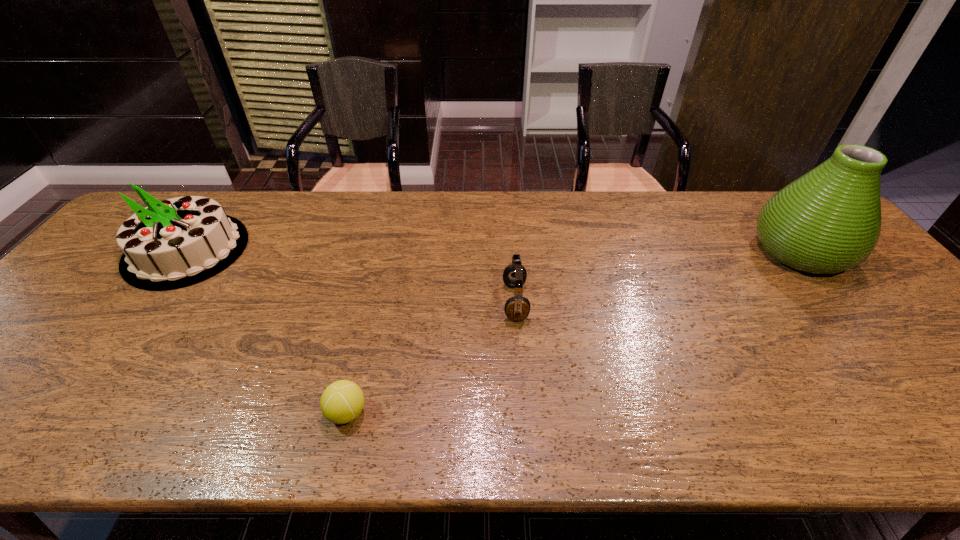
The image size is (960, 540). What are the coordinates of `object that is at the far right corner` in the screenshot? It's located at tap(827, 221).

I want to click on vacant space at the far edge of the desktop, so click(x=673, y=220).

Where is `free space at the near edge of the desktop`? The height and width of the screenshot is (540, 960). free space at the near edge of the desktop is located at coordinates (127, 424).

The image size is (960, 540). Identify the location of vacant region at the left edge of the desktop. (22, 356).

I want to click on vacant position at the right edge of the desktop, so [x=939, y=376].

Find the location of `free space between the rightmost object and the tennis ball`. free space between the rightmost object and the tennis ball is located at coordinates (573, 332).

Find the location of `free space between the tallest object and the nearest object`. free space between the tallest object and the nearest object is located at coordinates (573, 332).

Image resolution: width=960 pixels, height=540 pixels. I want to click on free area in between the shortest object and the vase, so click(573, 332).

In order to click on free space between the nearest object and the vase in this screenshot , I will do `click(573, 332)`.

Identify the location of unoccupied position between the third tallest object and the nearest object. The image size is (960, 540). (431, 357).